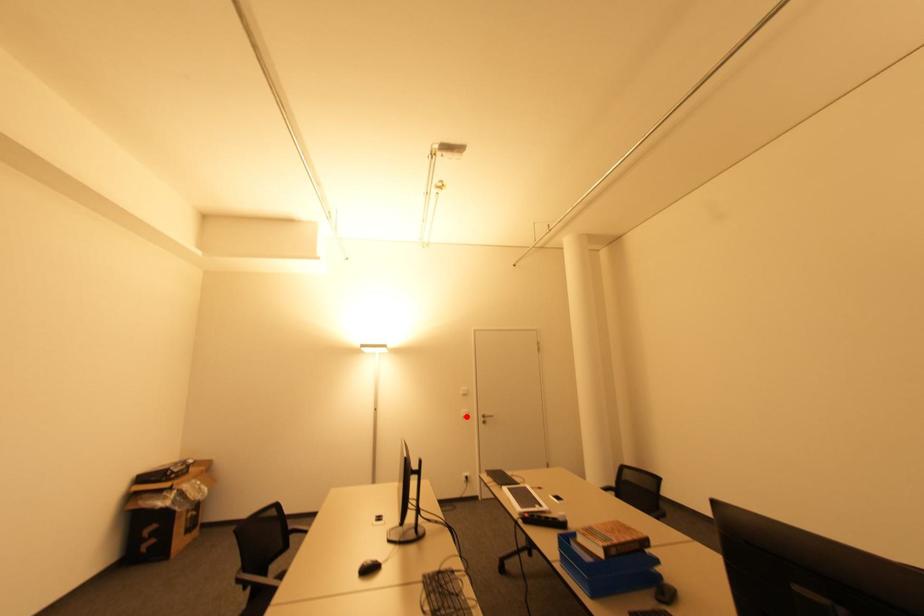
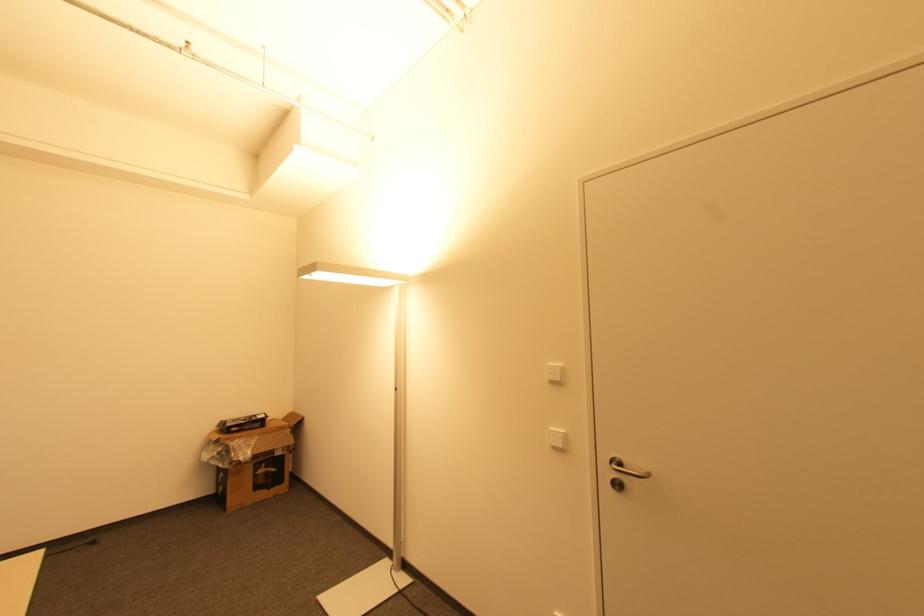
Find the pixel in the second image that matches the highlighted location in the first image.

(557, 448)